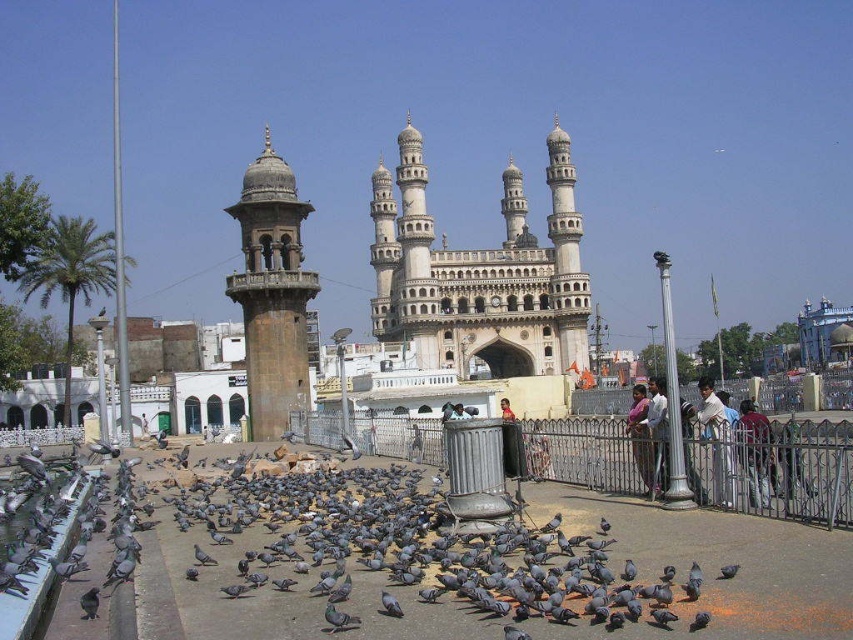
Question: Is silver metallic fence at center positioned at the back of dark brown leather jacket at center?

Choices:
 (A) no
 (B) yes

Answer: (A)

Question: Is stone tower at center left bigger than dark red shirt at right?

Choices:
 (A) no
 (B) yes

Answer: (B)

Question: Which object is the farthest from the gray matte pigeon at center?

Choices:
 (A) dark red shirt at right
 (B) light blue shirt at center
 (C) stone carved archway at center

Answer: (C)

Question: Which object is closer to the camera taking this photo?

Choices:
 (A) white cotton shirt at right
 (B) light blue shirt at center
 (C) dark red shirt at right
 (D) stone carved archway at center

Answer: (C)

Question: Is stone tower at center left above dark brown leather jacket at center?

Choices:
 (A) yes
 (B) no

Answer: (A)

Question: Which point appears closest to the camera in this image?

Choices:
 (A) (733, 576)
 (B) (711, 380)

Answer: (A)